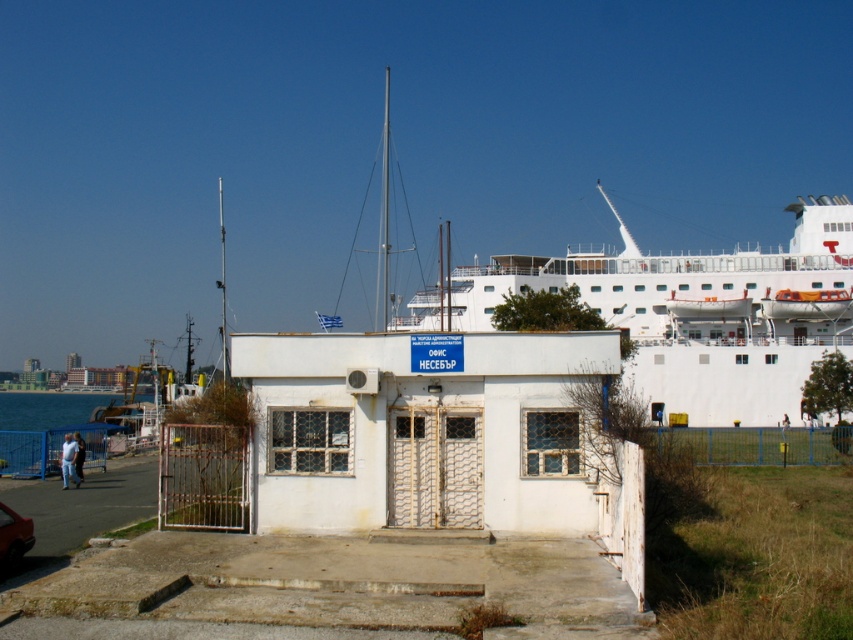
Question: Considering the real-world distances, which object is farthest from the shiny red car at lower left?

Choices:
 (A) white glossy ship at upper center
 (B) blue water at lower left

Answer: (A)

Question: Is white glossy ship at upper center in front of shiny red car at lower left?

Choices:
 (A) no
 (B) yes

Answer: (A)

Question: Can you confirm if white glossy ship at upper center is positioned below shiny red car at lower left?

Choices:
 (A) yes
 (B) no

Answer: (B)

Question: Does white glossy ship at upper center come in front of shiny red car at lower left?

Choices:
 (A) no
 (B) yes

Answer: (A)

Question: Which of the following is the closest to the observer?

Choices:
 (A) (798, 339)
 (B) (86, 442)

Answer: (B)

Question: Which point appears farthest from the camera in this image?

Choices:
 (A) (6, 518)
 (B) (679, 310)
 (C) (100, 465)

Answer: (B)